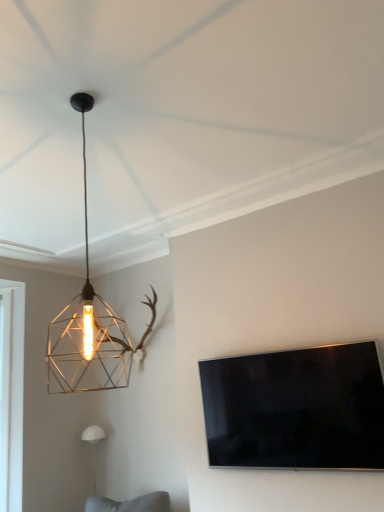
What do you see at coordinates (296, 409) in the screenshot?
I see `flat-screen tv at right` at bounding box center [296, 409].

In order to face white matte wall sconce at lower left, which is the first lamp from bottom to top, should I rotate leftwards or rightwards?

Turn left approximately 12.790 degrees to face it.

Locate an element on the screen. The image size is (384, 512). metallic wire cage at upper left, positioned as the 1th lamp in right-to-left order is located at coordinates (90, 326).

From the image's perspective, relative to white matte wall sconce at lower left, which is the second lamp from top to bottom, is metallic wire cage at upper left, the second lamp positioned from the back, above or below?

Clearly, from the image's perspective, metallic wire cage at upper left, the second lamp positioned from the back, is above white matte wall sconce at lower left, which is the second lamp from top to bottom.

Is metallic wire cage at upper left, the second lamp positioned from the back, bigger or smaller than white matte wall sconce at lower left, the first lamp in the back-to-front sequence?

Clearly, metallic wire cage at upper left, the second lamp positioned from the back, is larger in size than white matte wall sconce at lower left, the first lamp in the back-to-front sequence.

Is metallic wire cage at upper left, positioned as the 1th lamp in right-to-left order, aimed at white matte wall sconce at lower left, which appears as the 1th lamp when viewed from the left?

No, metallic wire cage at upper left, positioned as the 1th lamp in right-to-left order, is not aimed at white matte wall sconce at lower left, which appears as the 1th lamp when viewed from the left.

In terms of width, does metallic wire cage at upper left, which is the first lamp from front to back, look wider or thinner when compared to white matte wall sconce at lower left, positioned as the 2th lamp in right-to-left order?

Considering their sizes, metallic wire cage at upper left, which is the first lamp from front to back, looks broader than white matte wall sconce at lower left, positioned as the 2th lamp in right-to-left order.

Between metallic wire cage at upper left, acting as the 2th lamp starting from the left, and flat-screen tv at right, which one has smaller size?

Smaller between the two is flat-screen tv at right.

Is metallic wire cage at upper left, acting as the 2th lamp starting from the left, to the left of flat-screen tv at right from the viewer's perspective?

Indeed, metallic wire cage at upper left, acting as the 2th lamp starting from the left, is positioned on the left side of flat-screen tv at right.

Is metallic wire cage at upper left, positioned as the 1th lamp in right-to-left order, not close to flat-screen tv at right?

Absolutely, metallic wire cage at upper left, positioned as the 1th lamp in right-to-left order, is distant from flat-screen tv at right.

Is metallic wire cage at upper left, acting as the 2th lamp starting from the left, aimed at flat-screen tv at right?

No, metallic wire cage at upper left, acting as the 2th lamp starting from the left, is not turned towards flat-screen tv at right.

Looking at this image, looking at the image, does flat-screen tv at right seem bigger or smaller compared to white matte wall sconce at lower left, the second lamp viewed from the front?

flat-screen tv at right is bigger than white matte wall sconce at lower left, the second lamp viewed from the front.

Locate an element on the screen. Image resolution: width=384 pixels, height=512 pixels. television lying on the right of white matte wall sconce at lower left, the first lamp in the back-to-front sequence is located at coordinates (296, 409).

Between flat-screen tv at right and white matte wall sconce at lower left, which is the first lamp from bottom to top, which one is positioned behind?

white matte wall sconce at lower left, which is the first lamp from bottom to top, is behind.

Are flat-screen tv at right and metallic wire cage at upper left, the second lamp positioned from the back, far apart?

Absolutely, flat-screen tv at right is distant from metallic wire cage at upper left, the second lamp positioned from the back.

From the picture: Is flat-screen tv at right facing away from metallic wire cage at upper left, positioned as the 1th lamp in right-to-left order?

No, flat-screen tv at right is not facing away from metallic wire cage at upper left, positioned as the 1th lamp in right-to-left order.

Measure the distance between flat-screen tv at right and metallic wire cage at upper left, positioned as the 1th lamp in right-to-left order.

flat-screen tv at right and metallic wire cage at upper left, positioned as the 1th lamp in right-to-left order, are 1.60 meters apart from each other.

Consider the image. Considering the relative sizes of flat-screen tv at right and metallic wire cage at upper left, the second lamp positioned from the back, in the image provided, is flat-screen tv at right shorter than metallic wire cage at upper left, the second lamp positioned from the back,?

Indeed, flat-screen tv at right has a lesser height compared to metallic wire cage at upper left, the second lamp positioned from the back.

Could you tell me if white matte wall sconce at lower left, which is the second lamp from top to bottom, is facing metallic wire cage at upper left, arranged as the 2th lamp when ordered from the bottom?

No, white matte wall sconce at lower left, which is the second lamp from top to bottom, is not oriented towards metallic wire cage at upper left, arranged as the 2th lamp when ordered from the bottom.

Are white matte wall sconce at lower left, the first lamp in the back-to-front sequence, and metallic wire cage at upper left, positioned as the 1th lamp in right-to-left order, far apart?

Actually, white matte wall sconce at lower left, the first lamp in the back-to-front sequence, and metallic wire cage at upper left, positioned as the 1th lamp in right-to-left order, are a little close together.

The height and width of the screenshot is (512, 384). Identify the location of lamp that appears below the metallic wire cage at upper left, the first lamp from the top (from a real-world perspective). (93, 434).

Between white matte wall sconce at lower left, which is the second lamp from top to bottom, and metallic wire cage at upper left, the first lamp from the top, which one is positioned behind?

white matte wall sconce at lower left, which is the second lamp from top to bottom, is behind.

From the image's perspective, which one is positioned lower, white matte wall sconce at lower left, the first lamp in the back-to-front sequence, or flat-screen tv at right?

white matte wall sconce at lower left, the first lamp in the back-to-front sequence, from the image's perspective.

In terms of size, does white matte wall sconce at lower left, the first lamp in the back-to-front sequence, appear bigger or smaller than flat-screen tv at right?

Clearly, white matte wall sconce at lower left, the first lamp in the back-to-front sequence, is smaller in size than flat-screen tv at right.

Based on the photo, between white matte wall sconce at lower left, the second lamp viewed from the front, and flat-screen tv at right, which one has larger width?

white matte wall sconce at lower left, the second lamp viewed from the front, is wider.

Who is shorter, white matte wall sconce at lower left, the second lamp viewed from the front, or flat-screen tv at right?

With less height is white matte wall sconce at lower left, the second lamp viewed from the front.

In order to click on lamp below the metallic wire cage at upper left, which is the first lamp from front to back (from the image's perspective) in this screenshot , I will do `click(93, 434)`.

Locate an element on the screen. lamp lying in front of the flat-screen tv at right is located at coordinates (90, 326).

Considering their positions, is metallic wire cage at upper left, positioned as the 1th lamp in right-to-left order, positioned further to flat-screen tv at right than white matte wall sconce at lower left, which is the second lamp from top to bottom?

Based on the image, white matte wall sconce at lower left, which is the second lamp from top to bottom, appears to be further to flat-screen tv at right.

From the image, which object appears to be farther from metallic wire cage at upper left, acting as the 2th lamp starting from the left, flat-screen tv at right or white matte wall sconce at lower left, positioned as the 2th lamp in right-to-left order?

flat-screen tv at right is positioned further to the anchor metallic wire cage at upper left, acting as the 2th lamp starting from the left.

Based on their spatial positions, is white matte wall sconce at lower left, which is the first lamp from bottom to top, or flat-screen tv at right further from metallic wire cage at upper left, the first lamp from the top?

flat-screen tv at right.

Estimate the real-world distances between objects in this image. Which object is closer to white matte wall sconce at lower left, which appears as the 1th lamp when viewed from the left, flat-screen tv at right or metallic wire cage at upper left, positioned as the 1th lamp in right-to-left order?

metallic wire cage at upper left, positioned as the 1th lamp in right-to-left order, is closer to white matte wall sconce at lower left, which appears as the 1th lamp when viewed from the left.

When comparing their distances from white matte wall sconce at lower left, which is the second lamp from top to bottom, does metallic wire cage at upper left, the first lamp from the top, or flat-screen tv at right seem closer?

metallic wire cage at upper left, the first lamp from the top, is positioned closer to the anchor white matte wall sconce at lower left, which is the second lamp from top to bottom.

When comparing their distances from flat-screen tv at right, does white matte wall sconce at lower left, which is the second lamp from top to bottom, or metallic wire cage at upper left, arranged as the 2th lamp when ordered from the bottom, seem closer?

Based on the image, metallic wire cage at upper left, arranged as the 2th lamp when ordered from the bottom, appears to be nearer to flat-screen tv at right.

Locate an element on the screen. television positioned between metallic wire cage at upper left, acting as the 2th lamp starting from the left, and white matte wall sconce at lower left, which is the first lamp from bottom to top, from near to far is located at coordinates (296, 409).